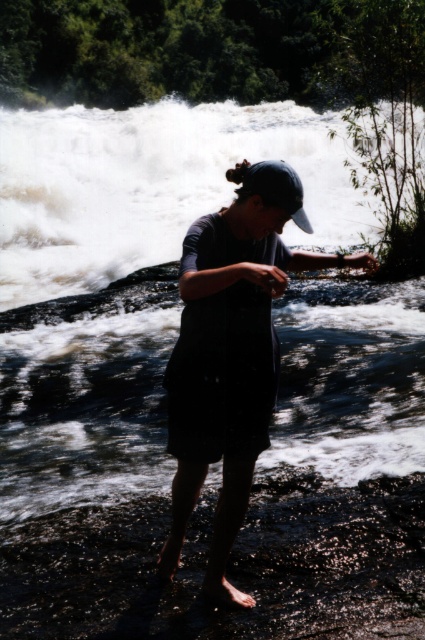
Who is more distant from viewer, [197,280] or [277,182]?

The point [277,182] is more distant.

Does point (269, 406) lie in front of point (277, 196)?

No, it is behind (277, 196).

You are a GUI agent. You are given a task and a screenshot of the screen. Output one action in this format:
    pyautogui.click(x=<x>, y=<y>)
    Task: Click on the dark blue fabric shirt at center
    Image resolution: width=425 pixels, height=640 pixels.
    Given the screenshot: What is the action you would take?
    pyautogui.click(x=231, y=353)